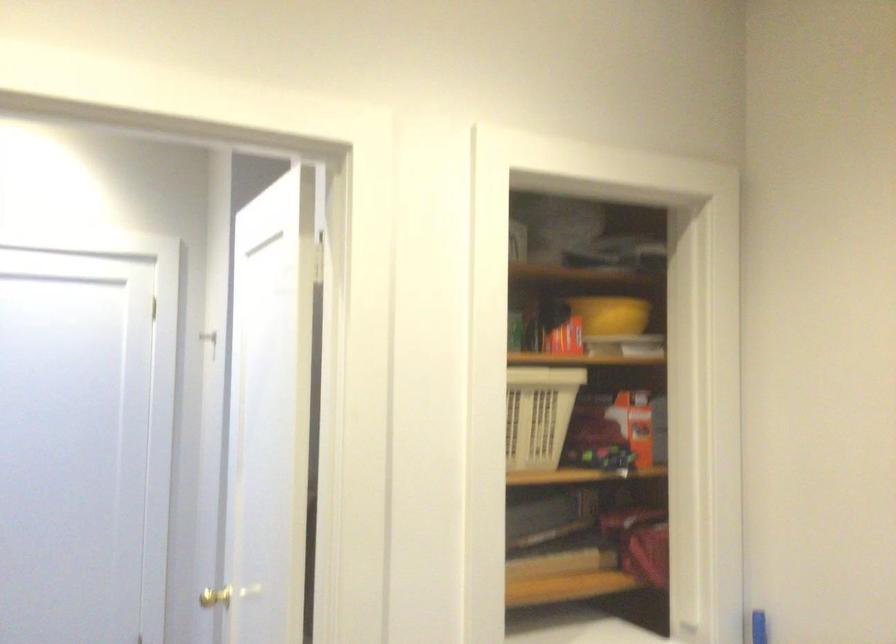
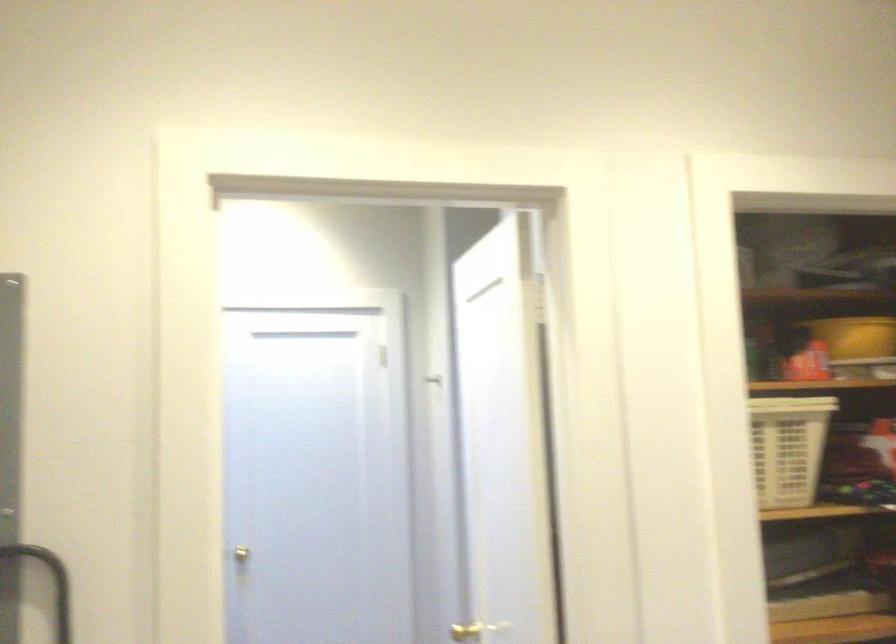
Find the pixel in the second image that matches [545,418] in the first image.

(788, 448)